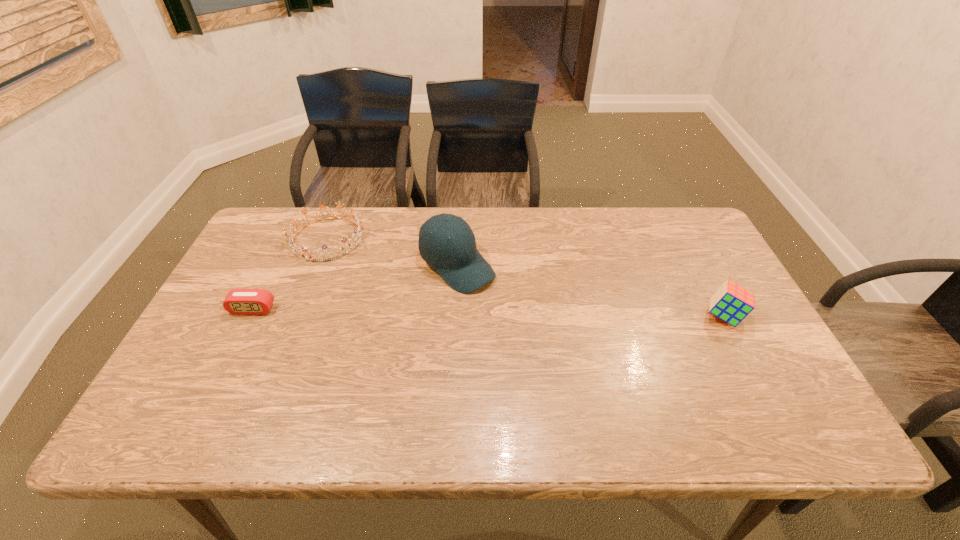
At what (x,y) coordinates should I click in order to perform the action: click on vacant space on the desktop that is between the shortest object and the cube and is positioned on the front-facing side of the second shortest object. Please return your answer as a coordinate pair (x, y). The image size is (960, 540). Looking at the image, I should click on (420, 312).

Locate an element on the screen. vacant space on the desktop that is between the shortest object and the rightmost object and is positioned on the front-facing side of the tallest object is located at coordinates (516, 313).